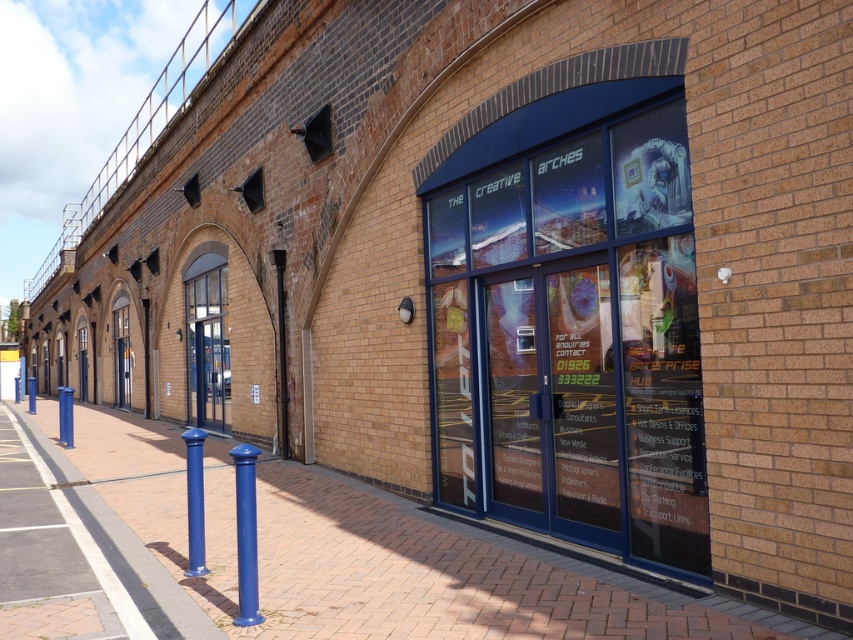
Does matte blue bollard at center have a greater height compared to blue metallic pole at left?

In fact, matte blue bollard at center may be shorter than blue metallic pole at left.

Looking at this image, how distant is matte blue bollard at center from blue metallic pole at left?

matte blue bollard at center is 10.29 meters from blue metallic pole at left.

At what (x,y) coordinates should I click in order to perform the action: click on matte blue bollard at center. Please return your answer as a coordinate pair (x, y). This screenshot has width=853, height=640. Looking at the image, I should click on (194, 500).

I want to click on matte blue bollard at center, so pyautogui.click(x=194, y=500).

Does blue matte pole at center have a lesser width compared to matte blue bollard at center?

In fact, blue matte pole at center might be wider than matte blue bollard at center.

Does blue matte pole at center appear on the left side of matte blue bollard at center?

Incorrect, blue matte pole at center is not on the left side of matte blue bollard at center.

Is point (238, 618) in front of point (204, 570)?

Yes.

You are a GUI agent. You are given a task and a screenshot of the screen. Output one action in this format:
    pyautogui.click(x=<x>, y=<y>)
    Task: Click on the blue matte pole at center
    This screenshot has width=853, height=640.
    Given the screenshot: What is the action you would take?
    pyautogui.click(x=247, y=534)

What do you see at coordinates (376, 556) in the screenshot?
I see `brick pavement at center` at bounding box center [376, 556].

Is brick pavement at center bigger than blue matte pole at center?

A: Indeed, brick pavement at center has a larger size compared to blue matte pole at center.

Who is more distant from viewer, (136,454) or (247,554)?

The point (136,454) is behind.

At what (x,y) coordinates should I click in order to perform the action: click on brick pavement at center. Please return your answer as a coordinate pair (x, y). Looking at the image, I should click on (376, 556).